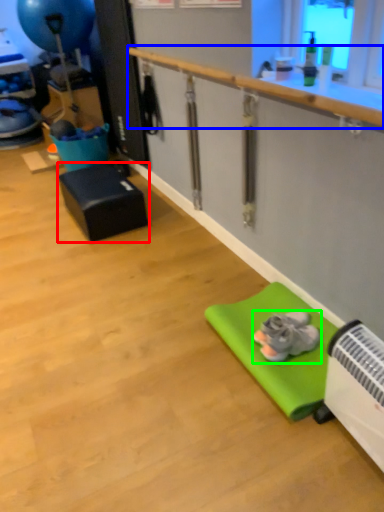
Question: Which object is positioned closest to furniture (highlighted by a red box)? Select from rail (highlighted by a blue box) and footwear (highlighted by a green box).

Choices:
 (A) rail
 (B) footwear

Answer: (A)